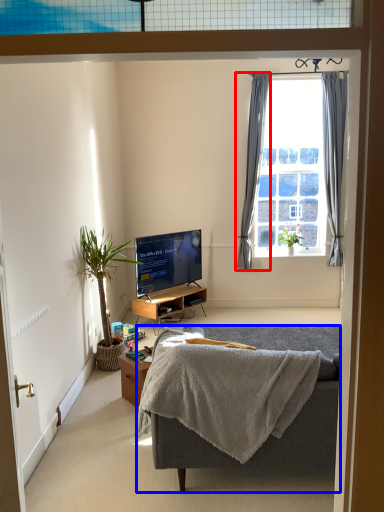
Question: Which object appears farthest to the camera in this image, curtain (highlighted by a red box) or studio couch (highlighted by a blue box)?

Choices:
 (A) curtain
 (B) studio couch

Answer: (A)